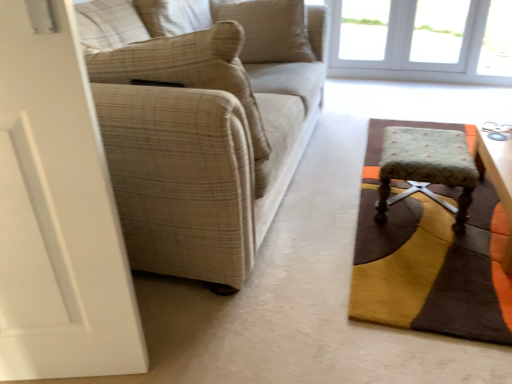
Question: Is beige textured pillow at upper center, which appears as the second pillow when viewed from the front, situated inside floral fabric stool at lower right or outside?

Choices:
 (A) inside
 (B) outside

Answer: (B)

Question: Looking at the image, does beige textured pillow at upper center, which appears as the first pillow when viewed from the back, seem bigger or smaller compared to floral fabric stool at lower right?

Choices:
 (A) small
 (B) big

Answer: (B)

Question: Estimate the real-world distances between objects in this image. Which object is farther from the beige textured pillow at left, which is the 2th pillow in top-to-bottom order?

Choices:
 (A) beige textured pillow at upper center, positioned as the 2th pillow in bottom-to-top order
 (B) beige plaid fabric couch at left
 (C) white glass window at upper right
 (D) floral fabric stool at lower right
 (E) textured brown rug at lower right

Answer: (C)

Question: Based on their relative distances, which object is farther from the white glass window at upper right?

Choices:
 (A) floral fabric stool at lower right
 (B) beige textured pillow at upper center, which is the first pillow from top to bottom
 (C) wooden round table at right
 (D) beige plaid fabric couch at left
 (E) textured brown rug at lower right

Answer: (E)